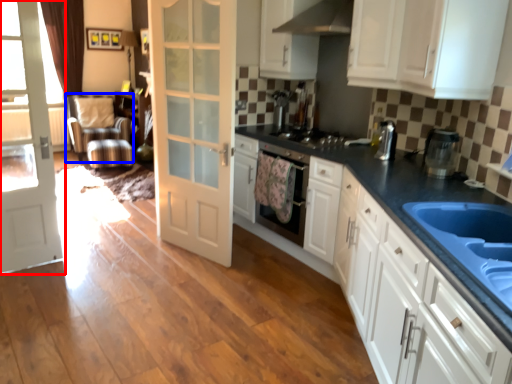
Question: Which of the following is the closest to the observer, door (highlighted by a red box) or sit (highlighted by a blue box)?

Choices:
 (A) door
 (B) sit

Answer: (A)